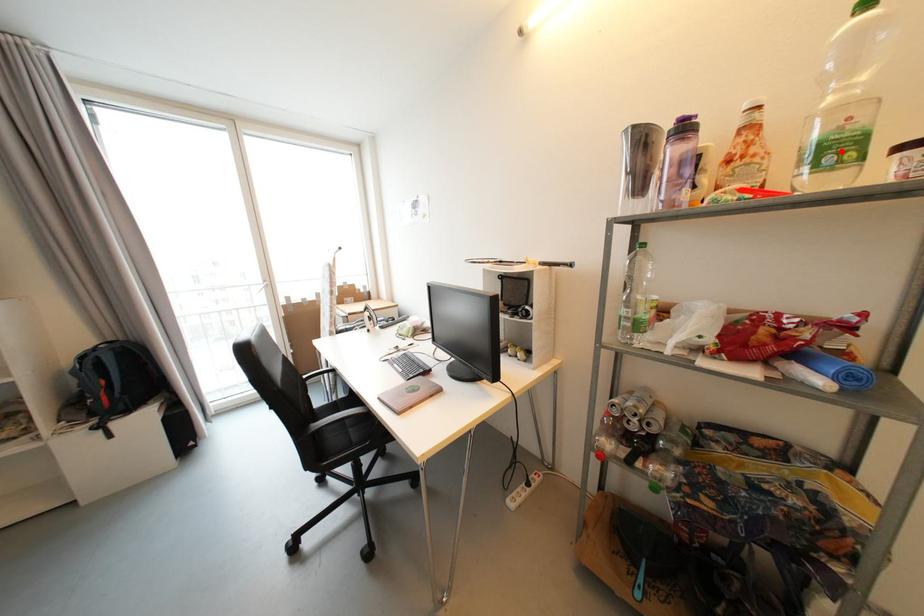
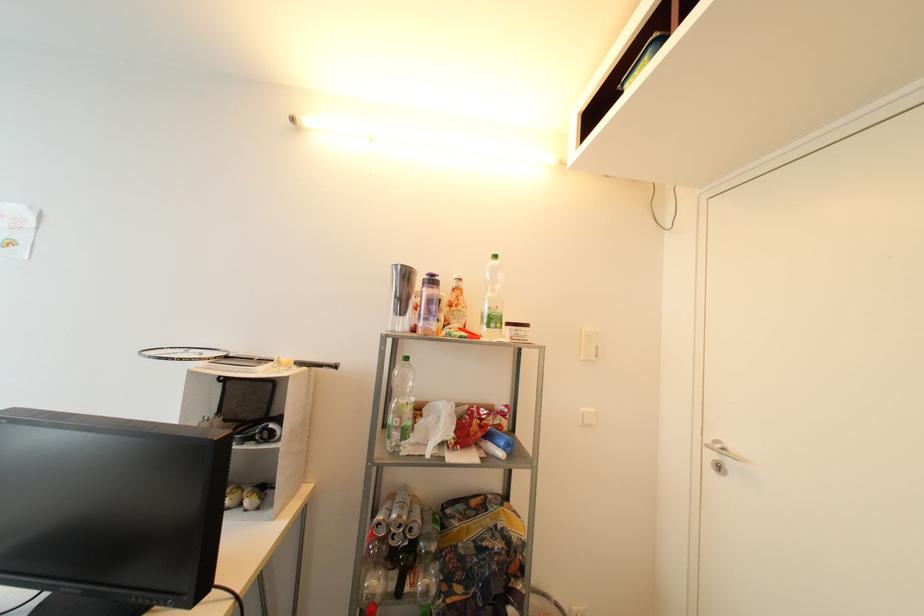
Find the pixel in the second image that matches the highlighted location in the first image.

(499, 322)